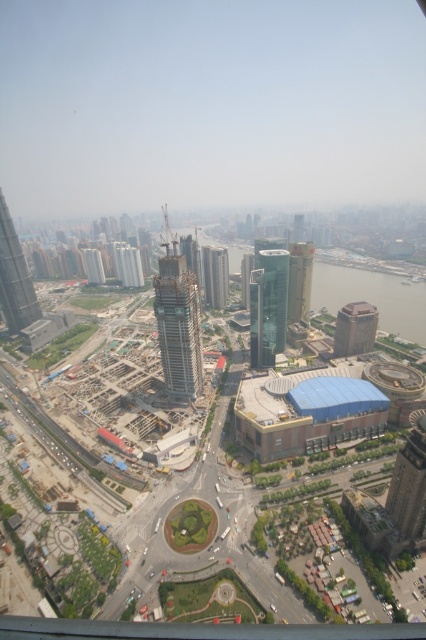
Does green glass tower at center appear on the left side of glassy steel skyscraper at left?

Incorrect, green glass tower at center is not on the left side of glassy steel skyscraper at left.

In the scene shown: Who is more forward, (267,268) or (2,273)?

Point (267,268) is more forward.

The width and height of the screenshot is (426, 640). I want to click on green glass tower at center, so click(267, 305).

Does brown brick building at right appear on the left side of glassy skyscraper at center?

In fact, brown brick building at right is to the right of glassy skyscraper at center.

Between point (408, 531) and point (226, 301), which one is positioned behind?

Point (226, 301)

Identify the location of brown brick building at right. Image resolution: width=426 pixels, height=640 pixels. (409, 483).

Is glassy steel skyscraper at left positioned at the back of glassy concrete skyscraper at center-left?

No, glassy steel skyscraper at left is in front of glassy concrete skyscraper at center-left.

Which is more to the left, glassy steel skyscraper at left or glassy concrete skyscraper at center-left?

glassy steel skyscraper at left

Who is more distant from viewer, (17, 257) or (94, 282)?

Point (94, 282)

This screenshot has width=426, height=640. I want to click on glassy steel skyscraper at left, so pyautogui.click(x=14, y=276).